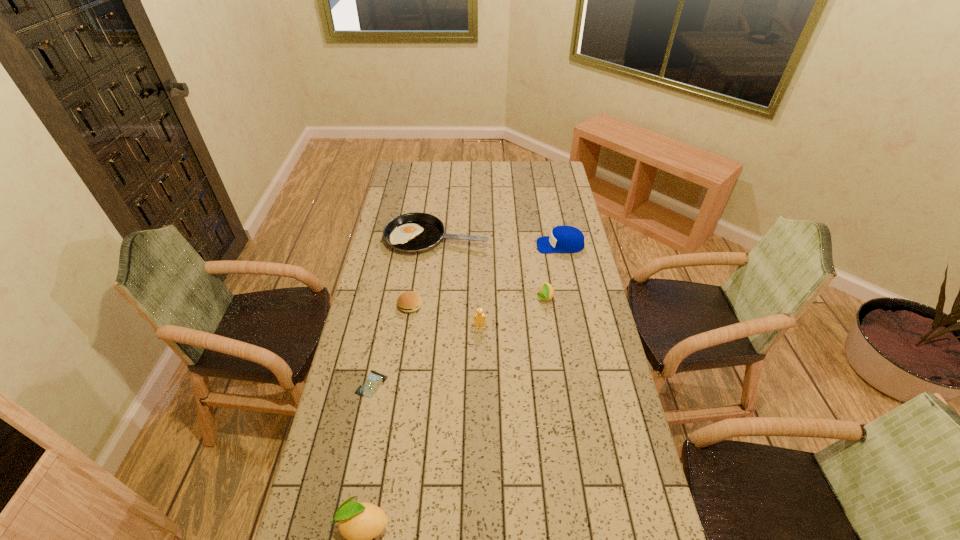
Locate an element on the screen. This screenshot has width=960, height=540. free point located 0.140m on the right of the patty is located at coordinates (459, 305).

I want to click on free space located on the back of the shortest object, so click(391, 288).

Find the location of `vacant region located on the front-facing side of the baseball cap`. vacant region located on the front-facing side of the baseball cap is located at coordinates (483, 245).

Where is `vacant space positioned 0.270m on the front-facing side of the baseball cap`? The image size is (960, 540). vacant space positioned 0.270m on the front-facing side of the baseball cap is located at coordinates (476, 245).

You are a GUI agent. You are given a task and a screenshot of the screen. Output one action in this format:
    pyautogui.click(x=<x>, y=<y>)
    Task: Click on the vacant space located on the front-facing side of the baseball cap
    
    Given the screenshot: What is the action you would take?
    pyautogui.click(x=483, y=245)

At what (x,y) coordinates should I click in order to perform the action: click on vacant area situated 0.120m on the face of the Lego. Please return your answer as a coordinate pair (x, y). Looking at the image, I should click on (480, 358).

Find the location of a particular element. This screenshot has height=540, width=960. frying pan present at the left edge is located at coordinates (416, 232).

The image size is (960, 540). I want to click on patty that is at the left edge, so click(x=410, y=301).

This screenshot has width=960, height=540. Identify the location of identity card at the left edge. (374, 380).

Identify the location of object present at the right edge. This screenshot has width=960, height=540. (563, 239).